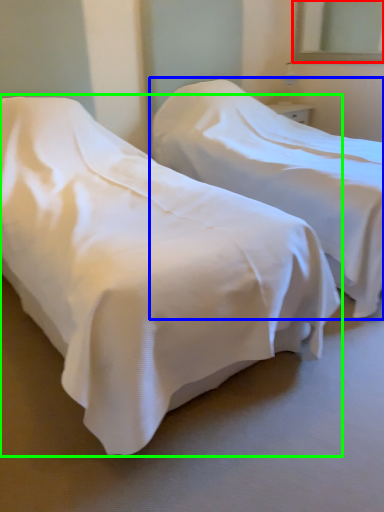
Question: Which object is positioned closest to mirror (highlighted by a red box)? Select from bed (highlighted by a blue box) and bed (highlighted by a green box).

Choices:
 (A) bed
 (B) bed

Answer: (A)